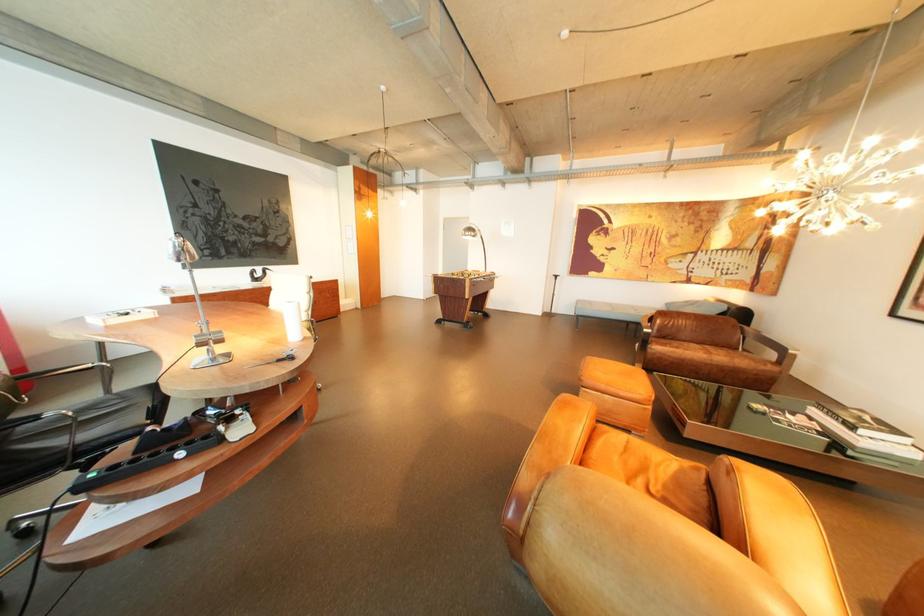
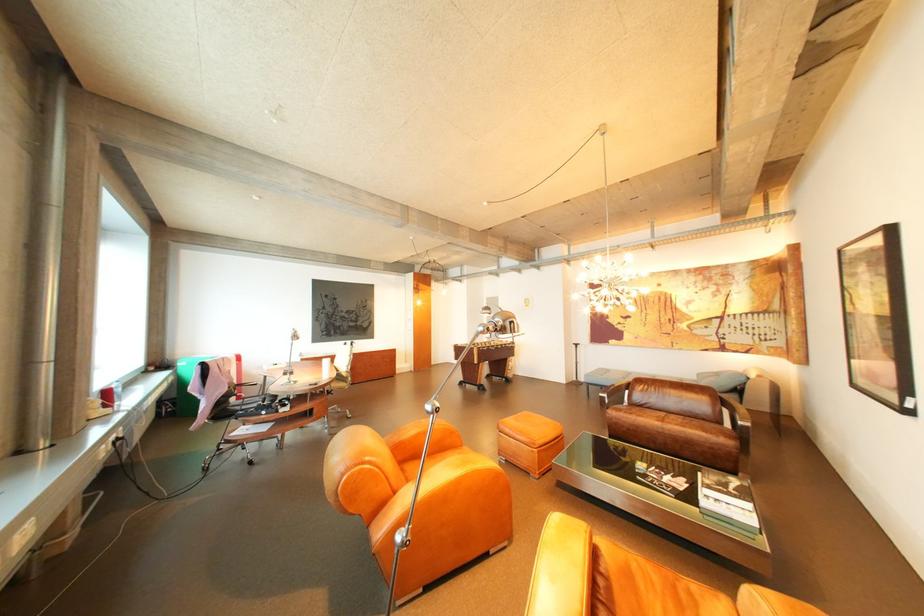
Which direction would the cameraman need to move to produce the second image?

The movement direction of the cameraman is right, backward.